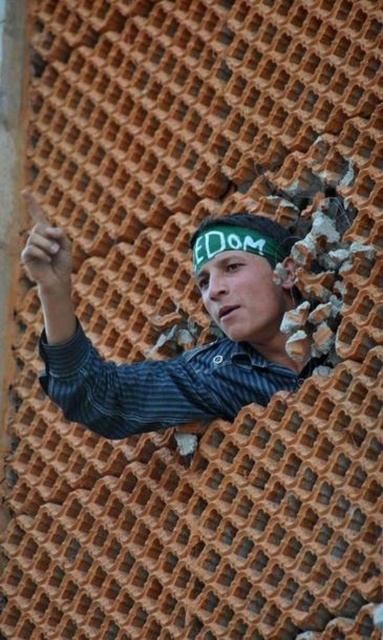
Is striped cotton shirt at center thinner than green fabric headscarf at center?

No.

Who is positioned more to the left, striped cotton shirt at center or green fabric headscarf at center?

striped cotton shirt at center is more to the left.

Which is in front, point (132, 385) or point (222, 228)?

Point (132, 385) is more forward.

This screenshot has width=383, height=640. What are the coordinates of `striped cotton shirt at center` in the screenshot? It's located at (157, 385).

Does striped shirt at upper left have a greater width compared to green fabric headscarf at center?

Correct, the width of striped shirt at upper left exceeds that of green fabric headscarf at center.

Who is positioned more to the right, striped shirt at upper left or green fabric headscarf at center?

From the viewer's perspective, green fabric headscarf at center appears more on the right side.

Describe the element at coordinates (176, 356) in the screenshot. This screenshot has height=640, width=383. I see `striped shirt at upper left` at that location.

Locate an element on the screen. The width and height of the screenshot is (383, 640). striped shirt at upper left is located at coordinates (176, 356).

Is point (284, 243) less distant than point (235, 387)?

No, it is behind (235, 387).

Between striped shirt at upper left and striped cotton shirt at center, which one has more height?

striped shirt at upper left

Which is in front, point (60, 301) or point (178, 413)?

Point (60, 301) is more forward.

This screenshot has width=383, height=640. I want to click on striped shirt at upper left, so click(x=176, y=356).